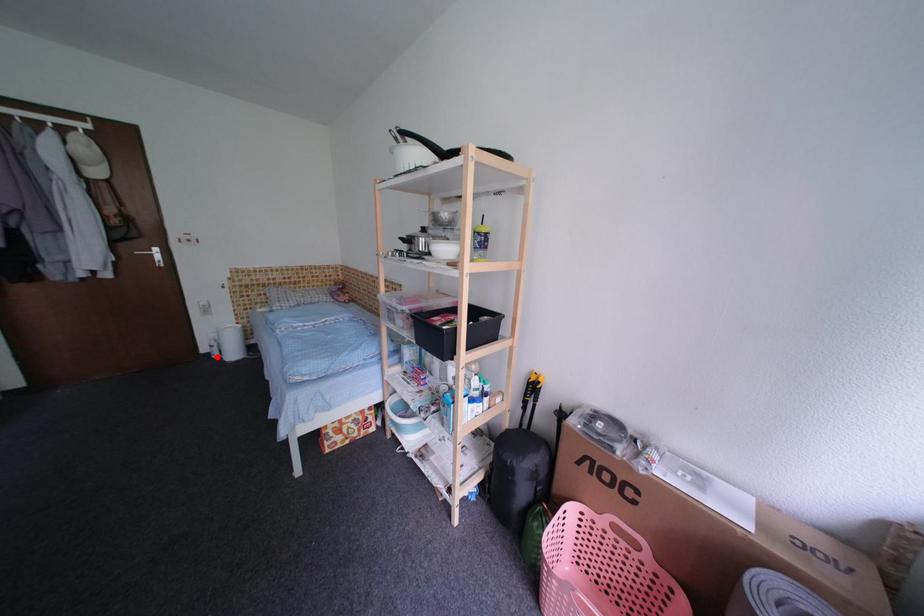
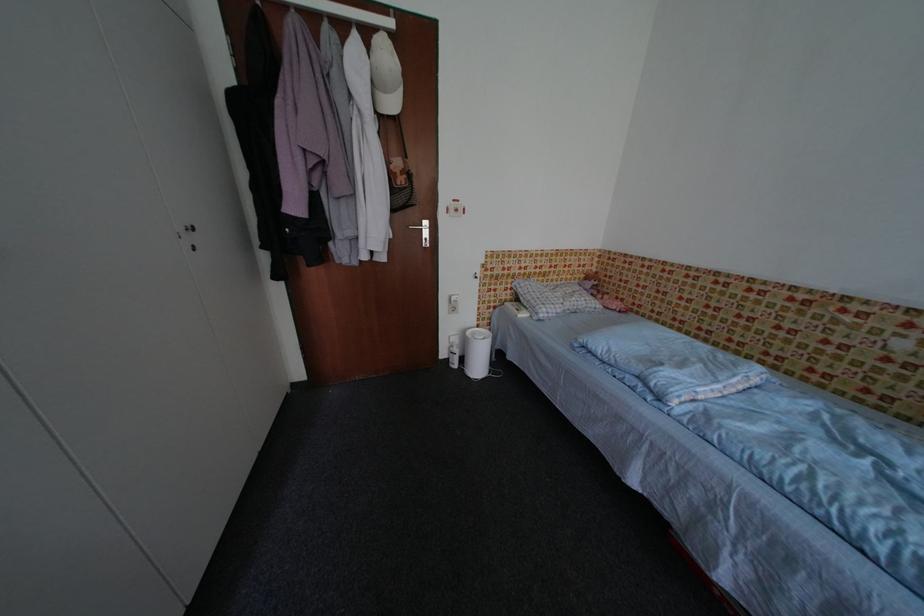
Question: A red point is marked in image1. In image2, is the corresponding 3D point closer to the camera or farther? Reply with the corresponding letter.

Choices:
 (A) The corresponding 3D point is closer.
 (B) The corresponding 3D point is farther.

Answer: (B)